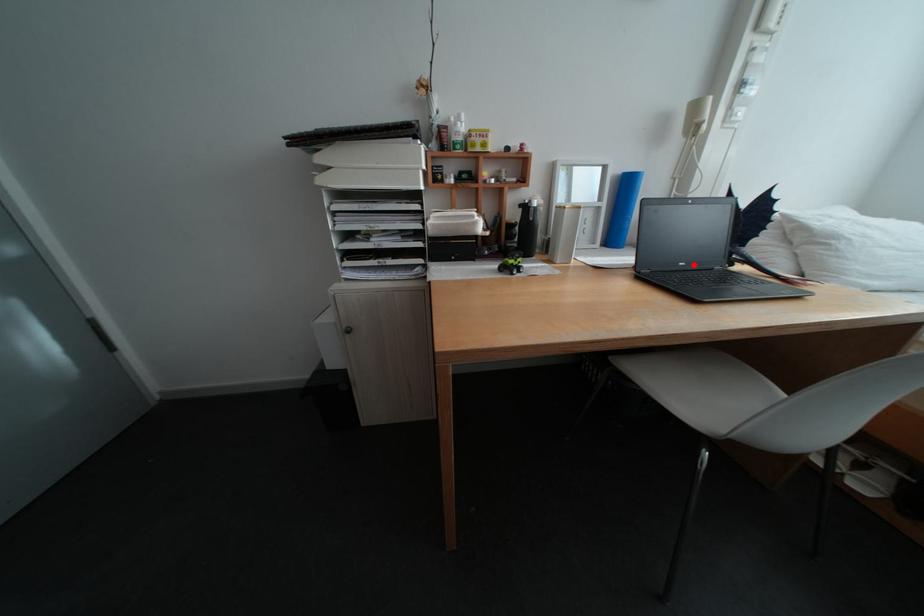
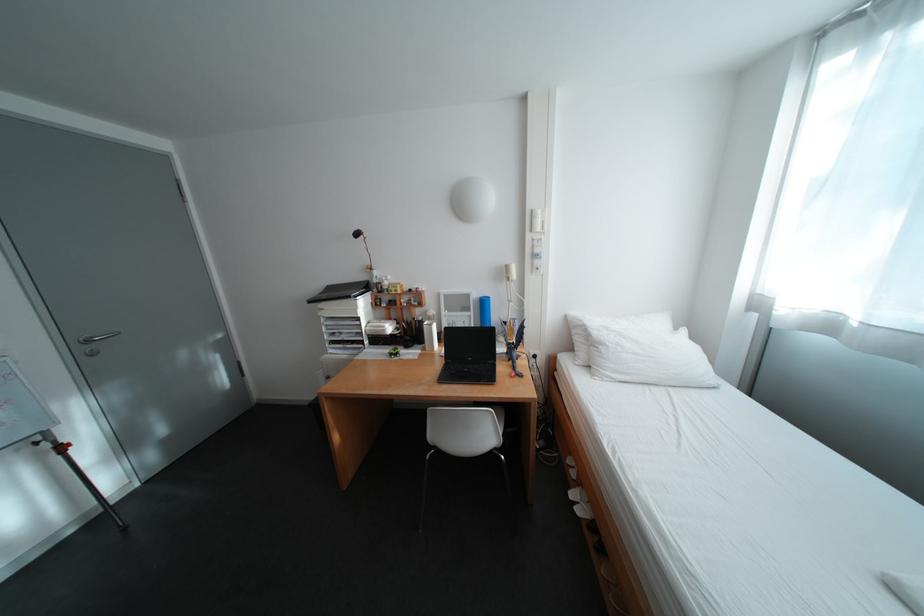
Find the pixel in the second image that matches the highlighted location in the first image.

(481, 360)